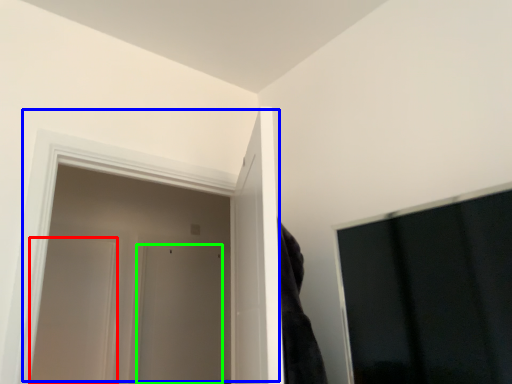
Question: Estimate the real-world distances between objects in this image. Which object is closer to door (highlighted by a red box), door (highlighted by a blue box) or door (highlighted by a green box)?

Choices:
 (A) door
 (B) door

Answer: (B)